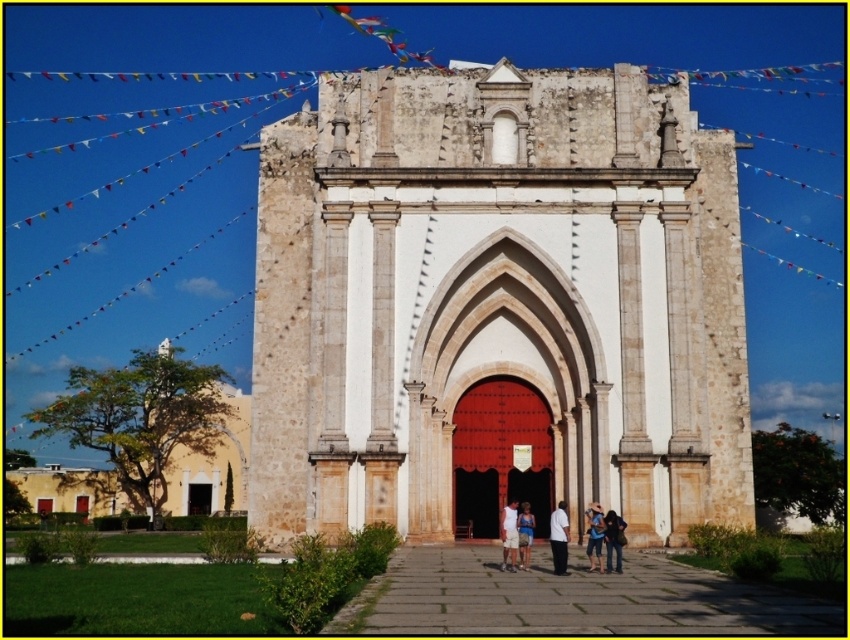
You are a visitor standing in front of the grand historic building. You need to enter through the smooth wooden door at center. However, there is a person wearing blue denim jeans at lower center blocking your path. Can you walk around them to reach the door?

The smooth wooden door at center is taller than blue denim jeans at lower center, so yes, you can walk around the person wearing blue denim jeans at lower center to reach the door since the door is higher and not blocking your path.

You are a photographer planning to take a portrait of two people wearing the white matte shirt at center and the blue fabric shirt at center. Since you want to emphasize the size difference between their shirts, which shirt should you place closer to the camera?

The white matte shirt at center is bigger than the blue fabric shirt at center, so to emphasize the size difference, you should place the white matte shirt at center closer to the camera.

You are standing in front of the historic building and see the point at coordinates (595, 536). What object is located at that specific point?

The blue denim jeans at lower center is located at point (595, 536).